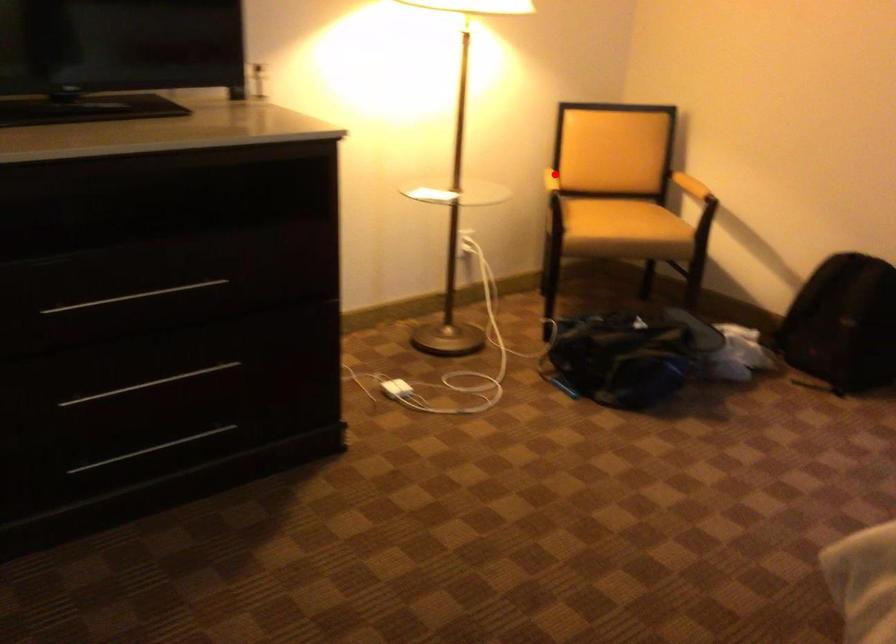
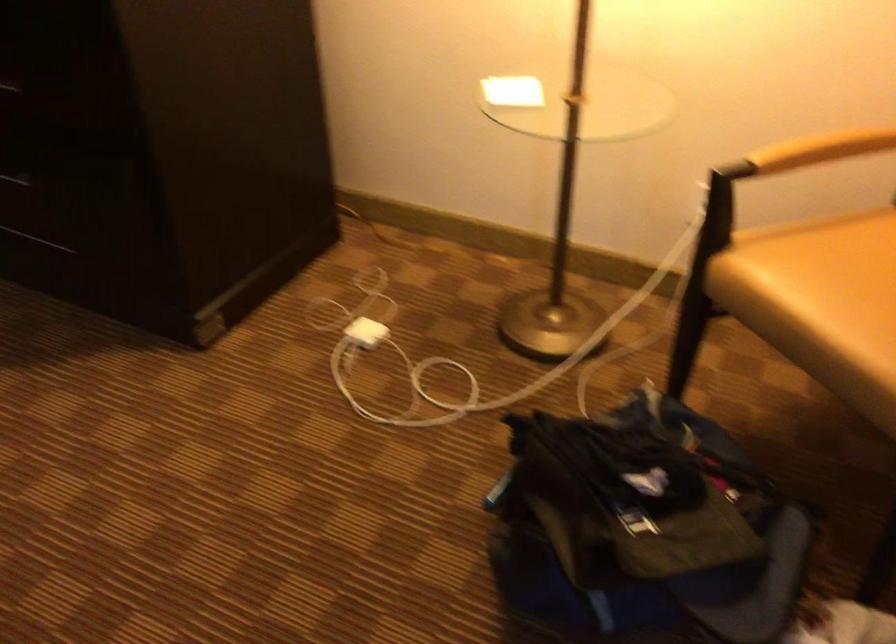
In the second image, find the point that corresponds to the highlighted location in the first image.

(821, 149)